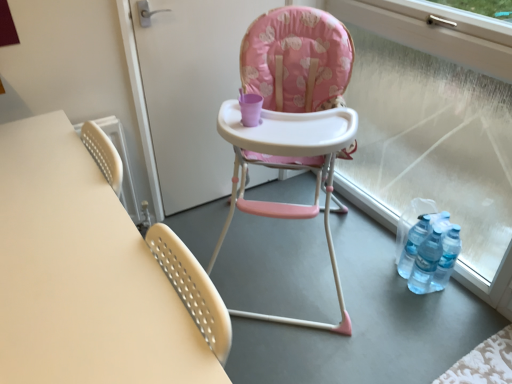
Question: From the image's perspective, is pink fabric highchair at center over matte white table at left?

Choices:
 (A) yes
 (B) no

Answer: (A)

Question: Is pink fabric highchair at center outside matte white table at left?

Choices:
 (A) no
 (B) yes

Answer: (B)

Question: Is pink fabric highchair at center positioned with its back to matte white table at left?

Choices:
 (A) yes
 (B) no

Answer: (B)

Question: Is pink fabric highchair at center wider than matte white table at left?

Choices:
 (A) no
 (B) yes

Answer: (B)

Question: Is pink fabric highchair at center at the right side of matte white table at left?

Choices:
 (A) yes
 (B) no

Answer: (A)

Question: Relative to pink fabric highchair at center, is pink fabric high chair at center in front or behind?

Choices:
 (A) front
 (B) behind

Answer: (B)

Question: From their relative heights in the image, would you say pink fabric high chair at center is taller or shorter than pink fabric highchair at center?

Choices:
 (A) tall
 (B) short

Answer: (B)

Question: Is pink fabric high chair at center inside the boundaries of pink fabric highchair at center, or outside?

Choices:
 (A) inside
 (B) outside

Answer: (B)

Question: From a real-world perspective, is pink fabric high chair at center above or below pink fabric highchair at center?

Choices:
 (A) above
 (B) below

Answer: (A)

Question: From a real-world perspective, is transparent glass window at right physically located above or below pink fabric high chair at center?

Choices:
 (A) below
 (B) above

Answer: (A)

Question: Is transparent glass window at right inside or outside of pink fabric high chair at center?

Choices:
 (A) inside
 (B) outside

Answer: (B)

Question: Does point (397, 137) appear closer or farther from the camera than point (155, 92)?

Choices:
 (A) closer
 (B) farther

Answer: (B)

Question: Considering the relative positions of transparent glass window at right and pink fabric high chair at center in the image provided, is transparent glass window at right to the left or to the right of pink fabric high chair at center?

Choices:
 (A) right
 (B) left

Answer: (A)

Question: Looking at the image, does transparent glass window at right seem bigger or smaller compared to matte white table at left?

Choices:
 (A) big
 (B) small

Answer: (A)

Question: From the image's perspective, is transparent glass window at right above or below matte white table at left?

Choices:
 (A) above
 (B) below

Answer: (A)